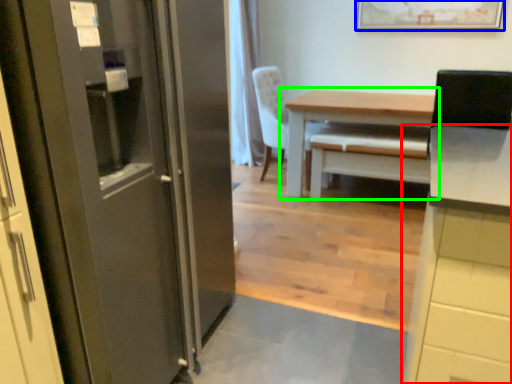
Question: Estimate the real-world distances between objects in this image. Which object is closer to cabinetry (highlighted by a red box), picture frame (highlighted by a blue box) or table (highlighted by a green box)?

Choices:
 (A) picture frame
 (B) table

Answer: (B)